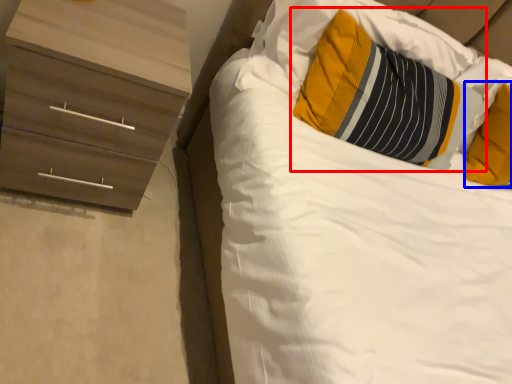
Question: Among these objects, which one is farthest to the camera, pillow (highlighted by a red box) or pillow (highlighted by a blue box)?

Choices:
 (A) pillow
 (B) pillow

Answer: (B)